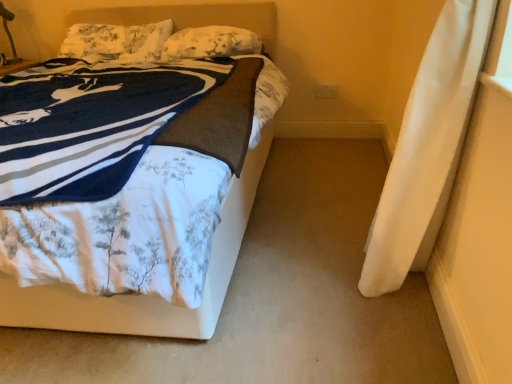
Locate an element on the screen. This screenshot has height=384, width=512. fluffy white pillow at upper center, placed as the 1th pillow when sorted from right to left is located at coordinates (211, 42).

Describe the element at coordinates (146, 295) in the screenshot. I see `white floral fabric bed at upper left` at that location.

The image size is (512, 384). Describe the element at coordinates (9, 33) in the screenshot. I see `metallic gold table lamp at upper left` at that location.

The width and height of the screenshot is (512, 384). In order to click on metallic gold table lamp at upper left in this screenshot , I will do `click(9, 33)`.

Where is `fluffy white pillow at upper left, which ranks as the 2th pillow in right-to-left order`? The height and width of the screenshot is (384, 512). fluffy white pillow at upper left, which ranks as the 2th pillow in right-to-left order is located at coordinates [116, 42].

Find the location of a particular element. The width and height of the screenshot is (512, 384). fluffy white pillow at upper center, arranged as the 2th pillow when viewed from the left is located at coordinates (211, 42).

Is white floral fabric bed at upper left oriented away from fluffy white pillow at upper left, which ranks as the 2th pillow in right-to-left order?

Yes, white floral fabric bed at upper left's orientation is away from fluffy white pillow at upper left, which ranks as the 2th pillow in right-to-left order.

From the image's perspective, is white floral fabric bed at upper left above fluffy white pillow at upper left, which ranks as the first pillow in left-to-right order?

No.

From the picture: Is white floral fabric bed at upper left not near fluffy white pillow at upper left, which ranks as the first pillow in left-to-right order?

Yes, white floral fabric bed at upper left and fluffy white pillow at upper left, which ranks as the first pillow in left-to-right order, are quite far apart.

Who is bigger, white floral fabric bed at upper left or fluffy white pillow at upper left, which ranks as the 2th pillow in right-to-left order?

Bigger between the two is white floral fabric bed at upper left.

Does white floral fabric bed at upper left touch fluffy white pillow at upper center, arranged as the 2th pillow when viewed from the left?

They are not placed beside each other.

Which object is closer to the camera taking this photo, white floral fabric bed at upper left or fluffy white pillow at upper center, arranged as the 2th pillow when viewed from the left?

Positioned in front is white floral fabric bed at upper left.

Is white floral fabric bed at upper left shorter than fluffy white pillow at upper center, arranged as the 2th pillow when viewed from the left?

No, white floral fabric bed at upper left is not shorter than fluffy white pillow at upper center, arranged as the 2th pillow when viewed from the left.

From the image's perspective, between white floral fabric bed at upper left and fluffy white pillow at upper center, placed as the 1th pillow when sorted from right to left, who is located below?

white floral fabric bed at upper left is shown below in the image.

Does fluffy white pillow at upper center, arranged as the 2th pillow when viewed from the left, touch white floral fabric bed at upper left?

No, fluffy white pillow at upper center, arranged as the 2th pillow when viewed from the left, is not next to white floral fabric bed at upper left.

Considering the relative sizes of fluffy white pillow at upper center, placed as the 1th pillow when sorted from right to left, and white floral fabric bed at upper left in the image provided, is fluffy white pillow at upper center, placed as the 1th pillow when sorted from right to left, smaller than white floral fabric bed at upper left?

Correct, fluffy white pillow at upper center, placed as the 1th pillow when sorted from right to left, occupies less space than white floral fabric bed at upper left.

Which of these two, fluffy white pillow at upper center, arranged as the 2th pillow when viewed from the left, or white floral fabric bed at upper left, stands shorter?

fluffy white pillow at upper center, arranged as the 2th pillow when viewed from the left, is shorter.

Is fluffy white pillow at upper center, placed as the 1th pillow when sorted from right to left, inside or outside of white floral fabric bed at upper left?

fluffy white pillow at upper center, placed as the 1th pillow when sorted from right to left, exists entirely within white floral fabric bed at upper left.

Is metallic gold table lamp at upper left in front of or behind fluffy white pillow at upper center, arranged as the 2th pillow when viewed from the left, in the image?

metallic gold table lamp at upper left is positioned farther from the viewer than fluffy white pillow at upper center, arranged as the 2th pillow when viewed from the left.

Can you see metallic gold table lamp at upper left touching fluffy white pillow at upper center, arranged as the 2th pillow when viewed from the left?

No, metallic gold table lamp at upper left is not beside fluffy white pillow at upper center, arranged as the 2th pillow when viewed from the left.

Based on the photo, between metallic gold table lamp at upper left and fluffy white pillow at upper center, arranged as the 2th pillow when viewed from the left, which one has more height?

metallic gold table lamp at upper left.

Is metallic gold table lamp at upper left aimed at fluffy white pillow at upper center, arranged as the 2th pillow when viewed from the left?

No, metallic gold table lamp at upper left does not turn towards fluffy white pillow at upper center, arranged as the 2th pillow when viewed from the left.

From the image's perspective, does fluffy white pillow at upper left, which ranks as the 2th pillow in right-to-left order, appear lower than metallic gold table lamp at upper left?

Correct, fluffy white pillow at upper left, which ranks as the 2th pillow in right-to-left order, appears lower than metallic gold table lamp at upper left in the image.

Can you confirm if fluffy white pillow at upper left, which ranks as the 2th pillow in right-to-left order, is shorter than metallic gold table lamp at upper left?

Yes.

Based on the photo, would you say fluffy white pillow at upper left, which ranks as the first pillow in left-to-right order, contains metallic gold table lamp at upper left?

No.

Between white floral fabric bed at upper left and metallic gold table lamp at upper left, which one is positioned behind?

metallic gold table lamp at upper left is further away from the camera.

Is point (147, 319) positioned after point (15, 55)?

No, (147, 319) is closer to viewer.

Can you tell me how much white floral fabric bed at upper left and metallic gold table lamp at upper left differ in facing direction?

white floral fabric bed at upper left and metallic gold table lamp at upper left are facing 2.11 degrees away from each other.

Does metallic gold table lamp at upper left have a smaller size compared to fluffy white pillow at upper left, which ranks as the 2th pillow in right-to-left order?

Correct, metallic gold table lamp at upper left occupies less space than fluffy white pillow at upper left, which ranks as the 2th pillow in right-to-left order.

Are metallic gold table lamp at upper left and fluffy white pillow at upper left, which ranks as the 2th pillow in right-to-left order, far apart?

No, metallic gold table lamp at upper left is not far from fluffy white pillow at upper left, which ranks as the 2th pillow in right-to-left order.

Can you confirm if metallic gold table lamp at upper left is positioned to the left of fluffy white pillow at upper left, which ranks as the 2th pillow in right-to-left order?

Answer: Yes.

Image resolution: width=512 pixels, height=384 pixels. What are the coordinates of `the 2nd pillow behind when counting from the white floral fabric bed at upper left` in the screenshot? It's located at (116, 42).

The height and width of the screenshot is (384, 512). I want to click on bed below the fluffy white pillow at upper center, placed as the 1th pillow when sorted from right to left (from the image's perspective), so click(146, 295).

Based on the photo, looking at the image, which one is located closer to fluffy white pillow at upper center, arranged as the 2th pillow when viewed from the left, fluffy white pillow at upper left, which ranks as the 2th pillow in right-to-left order, or white floral fabric bed at upper left?

Among the two, fluffy white pillow at upper left, which ranks as the 2th pillow in right-to-left order, is located nearer to fluffy white pillow at upper center, arranged as the 2th pillow when viewed from the left.

Based on their spatial positions, is white floral fabric bed at upper left or fluffy white pillow at upper center, placed as the 1th pillow when sorted from right to left, further from fluffy white pillow at upper left, which ranks as the first pillow in left-to-right order?

Among the two, white floral fabric bed at upper left is located further to fluffy white pillow at upper left, which ranks as the first pillow in left-to-right order.

Which object lies nearer to the anchor point fluffy white pillow at upper center, placed as the 1th pillow when sorted from right to left, metallic gold table lamp at upper left or fluffy white pillow at upper left, which ranks as the first pillow in left-to-right order?

The object closer to fluffy white pillow at upper center, placed as the 1th pillow when sorted from right to left, is fluffy white pillow at upper left, which ranks as the first pillow in left-to-right order.

Estimate the real-world distances between objects in this image. Which object is further from metallic gold table lamp at upper left, fluffy white pillow at upper left, which ranks as the 2th pillow in right-to-left order, or fluffy white pillow at upper center, arranged as the 2th pillow when viewed from the left?

Among the two, fluffy white pillow at upper center, arranged as the 2th pillow when viewed from the left, is located further to metallic gold table lamp at upper left.

Considering their positions, is fluffy white pillow at upper center, placed as the 1th pillow when sorted from right to left, positioned further to fluffy white pillow at upper left, which ranks as the 2th pillow in right-to-left order, than white floral fabric bed at upper left?

white floral fabric bed at upper left lies further to fluffy white pillow at upper left, which ranks as the 2th pillow in right-to-left order, than the other object.

From the image, which object appears to be farther from metallic gold table lamp at upper left, fluffy white pillow at upper left, which ranks as the first pillow in left-to-right order, or white floral fabric bed at upper left?

white floral fabric bed at upper left lies further to metallic gold table lamp at upper left than the other object.

Based on their spatial positions, is fluffy white pillow at upper center, placed as the 1th pillow when sorted from right to left, or metallic gold table lamp at upper left closer to fluffy white pillow at upper left, which ranks as the 2th pillow in right-to-left order?

Among the two, fluffy white pillow at upper center, placed as the 1th pillow when sorted from right to left, is located nearer to fluffy white pillow at upper left, which ranks as the 2th pillow in right-to-left order.

Estimate the real-world distances between objects in this image. Which object is closer to white floral fabric bed at upper left, fluffy white pillow at upper left, which ranks as the first pillow in left-to-right order, or metallic gold table lamp at upper left?

fluffy white pillow at upper left, which ranks as the first pillow in left-to-right order.

The width and height of the screenshot is (512, 384). What are the coordinates of `pillow between metallic gold table lamp at upper left and fluffy white pillow at upper center, placed as the 1th pillow when sorted from right to left, in the horizontal direction` in the screenshot? It's located at (116, 42).

Find the location of `pillow positioned between white floral fabric bed at upper left and fluffy white pillow at upper left, which ranks as the 2th pillow in right-to-left order, from near to far`. pillow positioned between white floral fabric bed at upper left and fluffy white pillow at upper left, which ranks as the 2th pillow in right-to-left order, from near to far is located at coordinates (211, 42).